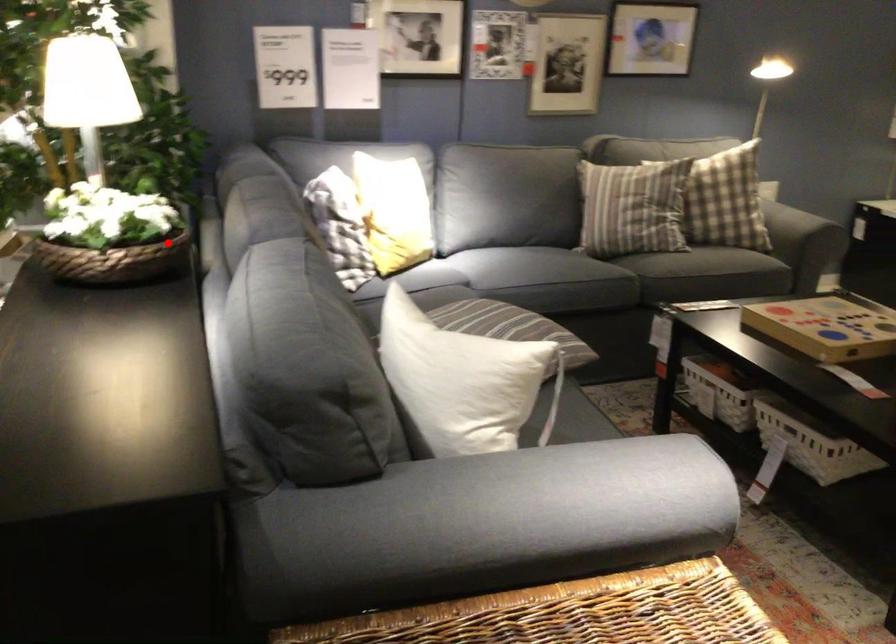
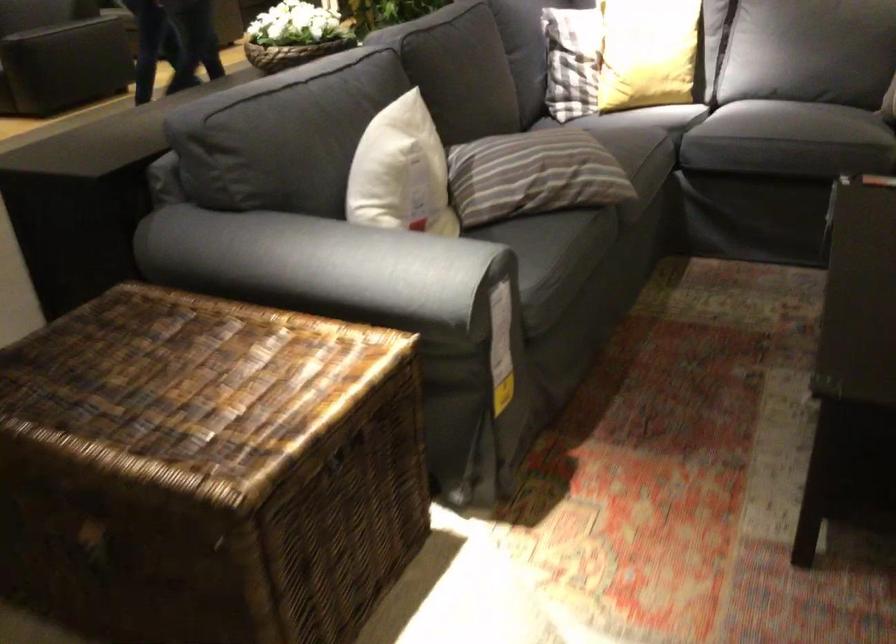
Locate, in the second image, the point that corresponds to the highlighted location in the first image.

(291, 53)